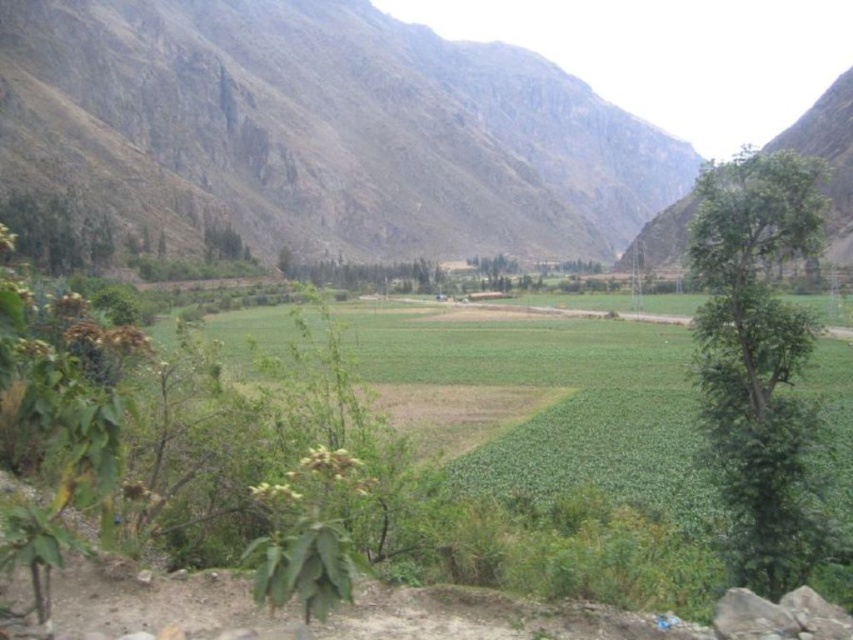
Who is positioned more to the left, green leafy tree at right or green leafy tree at center?

From the viewer's perspective, green leafy tree at center appears more on the left side.

Is green leafy tree at right to the left of green leafy tree at center from the viewer's perspective?

In fact, green leafy tree at right is to the right of green leafy tree at center.

Identify the location of green leafy tree at right. (758, 362).

Between brown rocky mountain at upper center and green leafy tree at center, which one has less height?

With less height is green leafy tree at center.

This screenshot has width=853, height=640. I want to click on brown rocky mountain at upper center, so click(328, 131).

Find the location of `brown rocky mountain at upper center`. brown rocky mountain at upper center is located at coordinates (328, 131).

How far apart are brown rocky mountain at upper center and green leafy tree at right?

The distance of brown rocky mountain at upper center from green leafy tree at right is 883.38 feet.

Is brown rocky mountain at upper center to the left of green leafy tree at right from the viewer's perspective?

Indeed, brown rocky mountain at upper center is positioned on the left side of green leafy tree at right.

Does point (142, 138) come behind point (791, 161)?

Yes, point (142, 138) is farther from viewer.

Locate an element on the screen. brown rocky mountain at upper center is located at coordinates (328, 131).